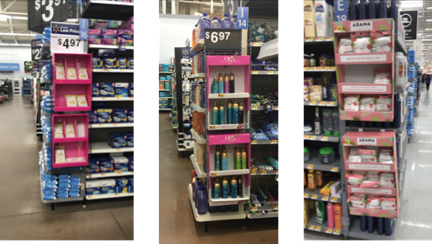
The image size is (432, 244). I want to click on floor of main store walking aisle to get down specific aisles, so click(x=19, y=205), click(x=169, y=207), click(x=418, y=219).